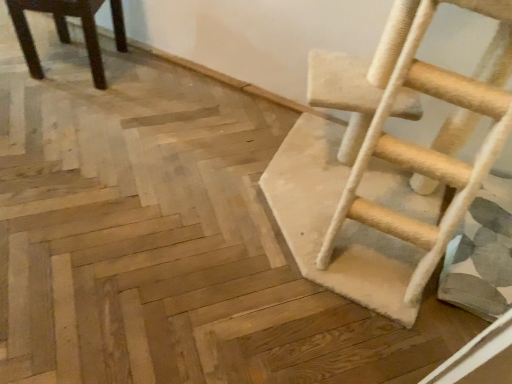
Identify the location of unoccupied region to the right of dark brown wood chair at upper left. (x=152, y=87).